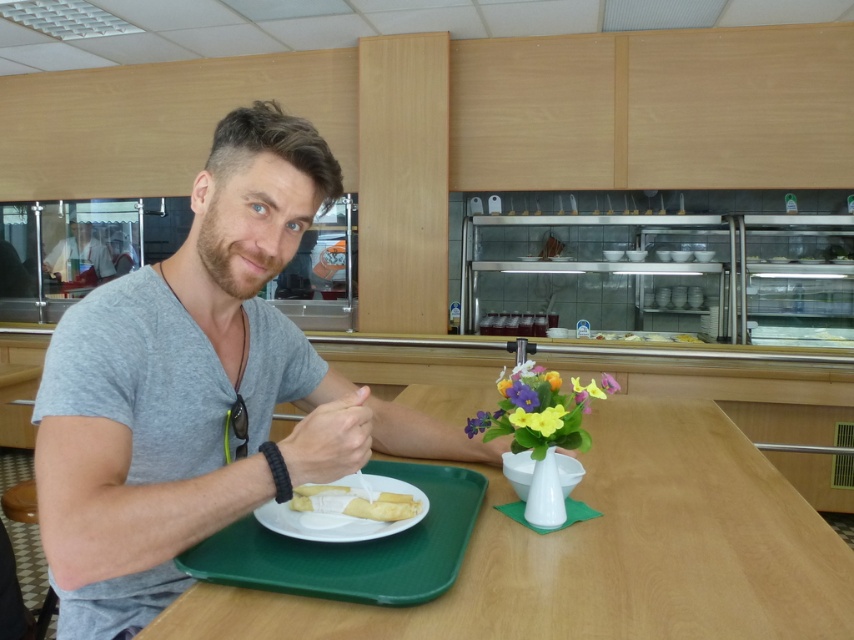
You are a person sitting at the wooden table at center. You want to place your phone on the yellow matte flower at center. Is the flower in a reachable position from where you are sitting?

The wooden table at center is in front of the yellow matte flower at center, meaning the flower is positioned behind the table. Since you are sitting at the table, the flower would be behind you and out of reach. Therefore, you cannot place your phone on the yellow matte flower at center from your current position.

You are a server in a cafeteria and need to place a new tray on the table. The tray is 30 cm wide. The table has the vibrant floral bouquet at center and the white glossy plate at center. Which object should you avoid placing the tray near to ensure it fits?

The vibrant floral bouquet at center has a lesser width compared to the white glossy plate at center, so you should avoid placing the tray near the white glossy plate at center to ensure it fits since it is wider.

You are a server in a restaurant and need to place a 20 inch long platter on the table. Can you fit it between the wooden table at center and the yellow matte flower at center?

The wooden table at center is 19.61 inches from the yellow matte flower at center. Since the platter is 20 inches long, it cannot be placed between them as the distance is shorter than the platter.